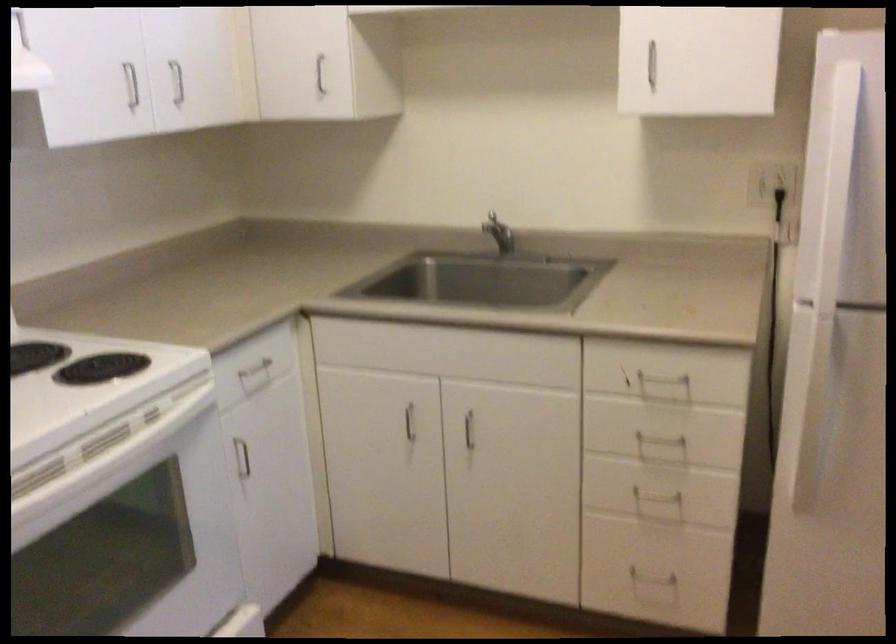
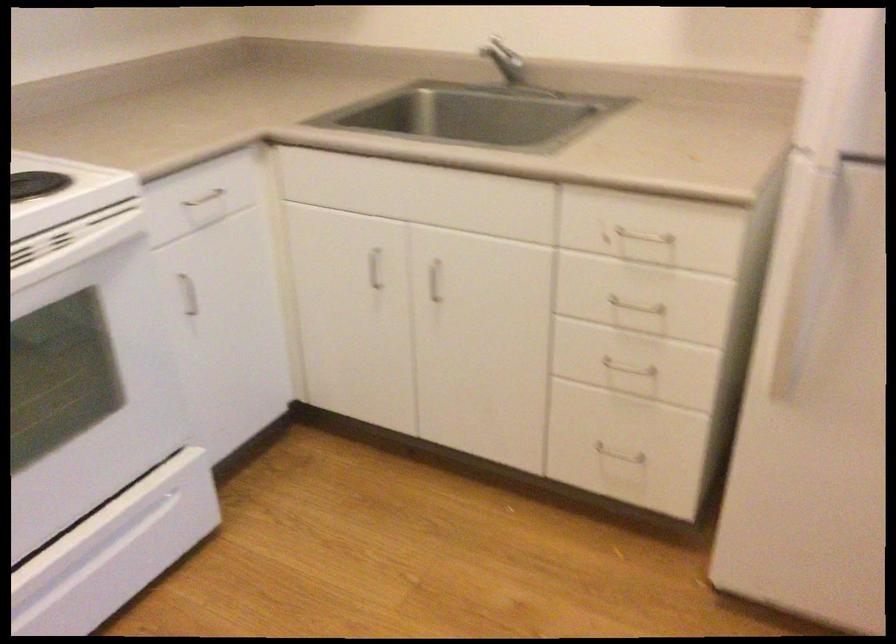
Locate, in the second image, the point that corresponds to (x=659, y=448) in the first image.

(634, 313)